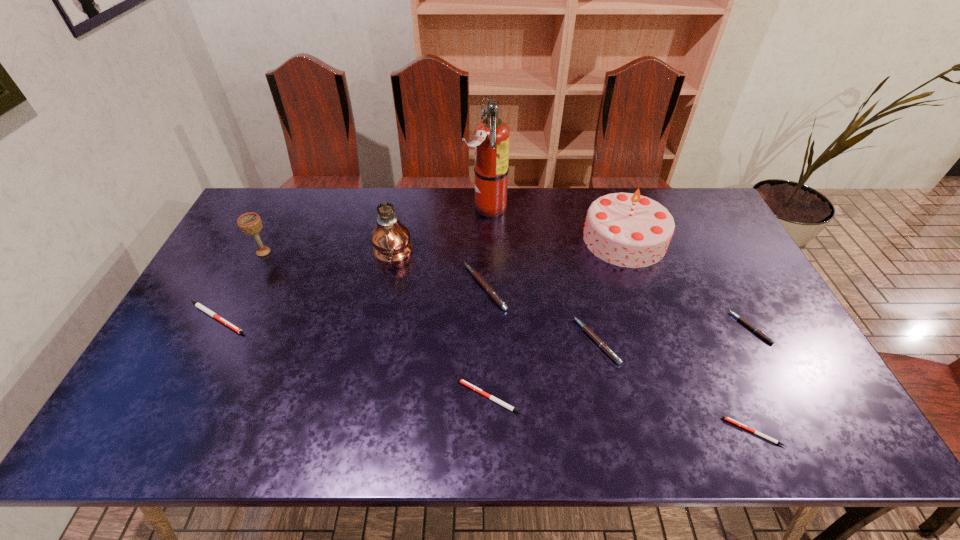
What are the coordinates of `fire extinguisher` in the screenshot? It's located at (491, 142).

The width and height of the screenshot is (960, 540). I want to click on the tallest object, so pyautogui.click(x=491, y=142).

Where is `the second tallest object`? the second tallest object is located at coordinates (391, 239).

Find the location of `oil lamp`. oil lamp is located at coordinates (391, 239).

Identify the location of birthday cake. (629, 230).

This screenshot has height=540, width=960. Identify the location of the fourth tallest object. (250, 223).

Where is `chalice`? chalice is located at coordinates (250, 223).

This screenshot has height=540, width=960. I want to click on the tallest pen, so click(x=489, y=290).

This screenshot has width=960, height=540. Find the location of `the biggest pink pen`. the biggest pink pen is located at coordinates (489, 290).

The height and width of the screenshot is (540, 960). In order to click on the second pink pen from left to right in this screenshot , I will do `click(584, 327)`.